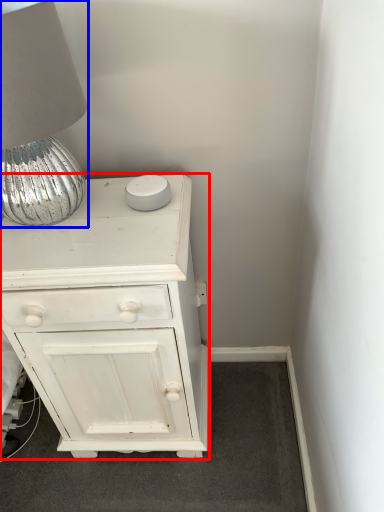
Question: Among these objects, which one is nearest to the camera, chest of drawers (highlighted by a red box) or table lamp (highlighted by a blue box)?

Choices:
 (A) chest of drawers
 (B) table lamp

Answer: (B)